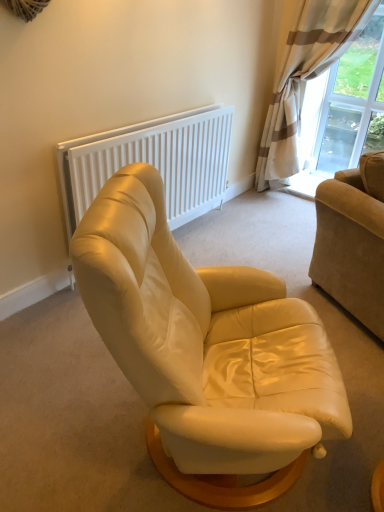
Locate an element on the screen. vacant area to the right of white matte radiator at upper center is located at coordinates (248, 242).